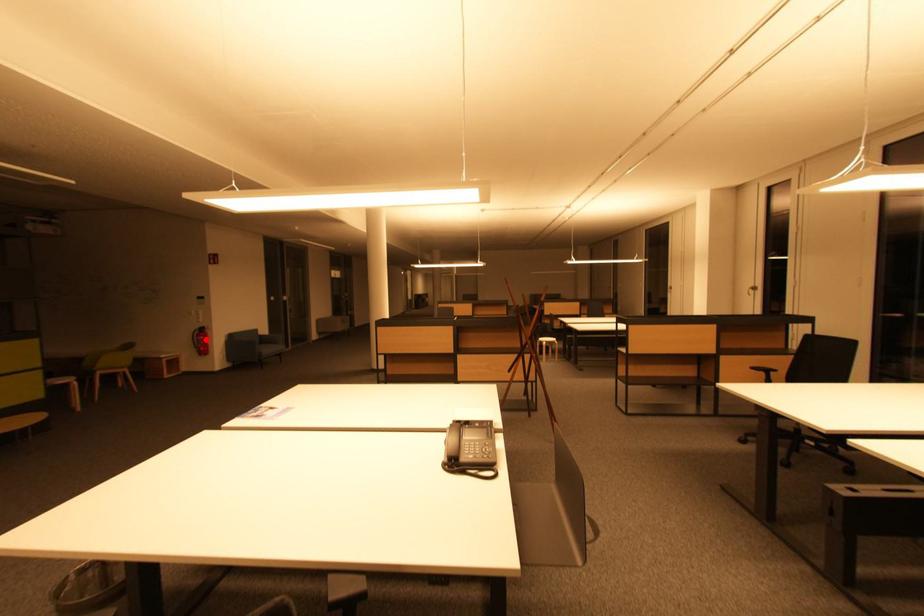
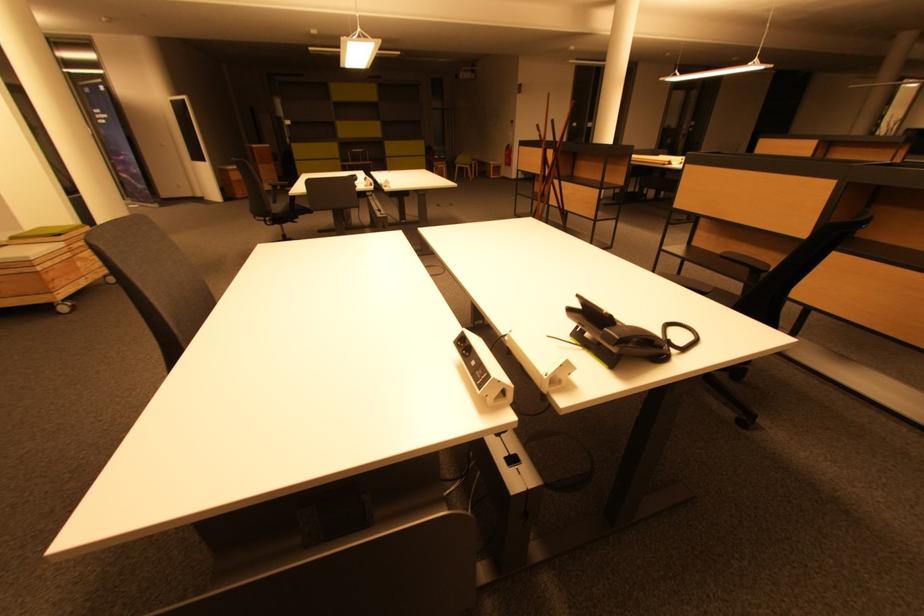
Question: A red point is marked in image1. In image2, is the corresponding 3D point closer to the camera or farther? Reply with the corresponding letter.

Choices:
 (A) The corresponding 3D point is closer.
 (B) The corresponding 3D point is farther.

Answer: (A)